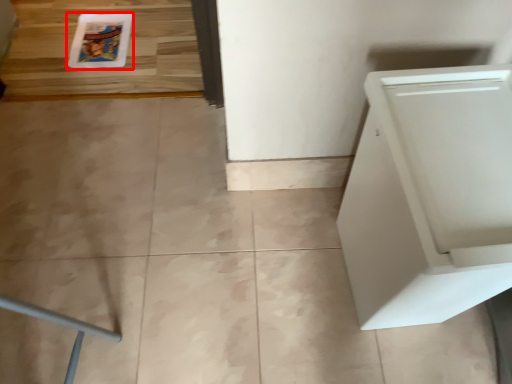
Question: Considering the relative positions of comic book (annotated by the red box) and home appliance in the image provided, where is comic book (annotated by the red box) located with respect to the staircase?

Choices:
 (A) right
 (B) left

Answer: (B)